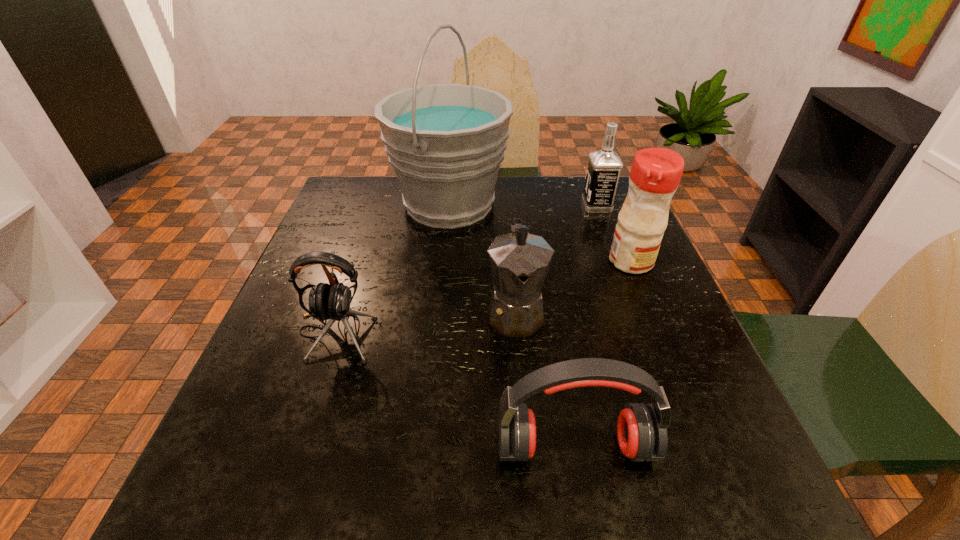
Locate an element on the screen. This screenshot has width=960, height=540. unoccupied area between the vodka and the nearest object is located at coordinates (586, 326).

Locate which object ranks fourth in proximity to the vodka. Please provide its 2D coordinates. Your answer should be formatted as a tuple, i.e. [(x, y)], where the tuple contains the x and y coordinates of a point satisfying the conditions above.

[(331, 302)]

Where is `object that is the third closest one to the tallest object`? Image resolution: width=960 pixels, height=540 pixels. object that is the third closest one to the tallest object is located at coordinates (655, 174).

The image size is (960, 540). Identify the location of blank space that satisfies the following two spatial constraints: 1. on the front label of the third farthest object; 2. on the left side of the vodka. (617, 261).